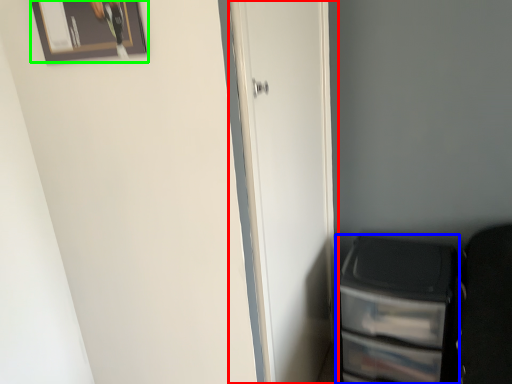
Question: Which object is positioned closest to door (highlighted by a red box)? Select from file cabinet (highlighted by a blue box) and picture frame (highlighted by a green box).

Choices:
 (A) file cabinet
 (B) picture frame

Answer: (A)